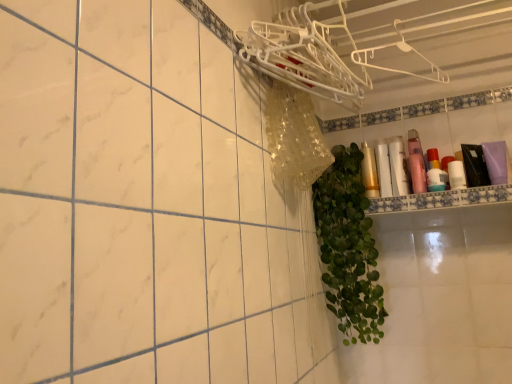
Describe the element at coordinates (383, 169) in the screenshot. I see `matte gold tube at upper right, which is the 2th toiletry in left-to-right order` at that location.

In order to face white glossy bottle at upper right, which ranks as the 3th toiletry in left-to-right order, should I rotate leftwards or rightwards?

Rotate right and turn 18.752 degrees.

This screenshot has width=512, height=384. What do you see at coordinates (442, 199) in the screenshot?
I see `white glossy shelf at upper right` at bounding box center [442, 199].

This screenshot has width=512, height=384. What are the coordinates of `pink matte bottle at upper right, the 4th toiletry viewed from the left` in the screenshot? It's located at (416, 163).

This screenshot has width=512, height=384. What do you see at coordinates (303, 55) in the screenshot? I see `white plastic hanger at upper right, which ranks as the second hanger in right-to-left order` at bounding box center [303, 55].

The image size is (512, 384). Identify the location of gold metallic can at center, which is the first toiletry in left-to-right order. (369, 172).

Is white glossy shelf at upper right wider or thinner than translucent plastic bottles at upper right, the 1th toiletry in the right-to-left sequence?

white glossy shelf at upper right is wider than translucent plastic bottles at upper right, the 1th toiletry in the right-to-left sequence.

From the image's perspective, does white glossy shelf at upper right appear higher than translucent plastic bottles at upper right, positioned as the 5th toiletry in left-to-right order?

Actually, white glossy shelf at upper right appears below translucent plastic bottles at upper right, positioned as the 5th toiletry in left-to-right order, in the image.

Could you tell me if white glossy shelf at upper right is facing translucent plastic bottles at upper right, the 1th toiletry in the right-to-left sequence?

No.

Is white glossy shelf at upper right far away from translucent plastic bottles at upper right, the 1th toiletry in the right-to-left sequence?

No.

Would you consider white glossy bottle at upper right, acting as the 3th toiletry starting from the right, to be distant from matte gold tube at upper right, which is the 2th toiletry in left-to-right order?

No, white glossy bottle at upper right, acting as the 3th toiletry starting from the right, is in close proximity to matte gold tube at upper right, which is the 2th toiletry in left-to-right order.

Visually, is white glossy bottle at upper right, acting as the 3th toiletry starting from the right, positioned to the left or to the right of matte gold tube at upper right, which is the 4th toiletry from right to left?

Clearly, white glossy bottle at upper right, acting as the 3th toiletry starting from the right, is on the right of matte gold tube at upper right, which is the 4th toiletry from right to left, in the image.

Between point (401, 187) and point (382, 164), which one is positioned behind?

The point (382, 164) is more distant.

From a real-world perspective, which object stands above the other?

matte gold tube at upper right, which is the 4th toiletry from right to left, from a real-world perspective.

Are green leafy plant at right and matte gold tube at upper right, which is the 2th toiletry in left-to-right order, making contact?

No, green leafy plant at right is not making contact with matte gold tube at upper right, which is the 2th toiletry in left-to-right order.

Is green leafy plant at right positioned with its back to matte gold tube at upper right, which is the 4th toiletry from right to left?

No, green leafy plant at right's orientation is not away from matte gold tube at upper right, which is the 4th toiletry from right to left.

Is green leafy plant at right at the left side of matte gold tube at upper right, which is the 4th toiletry from right to left?

Yes, green leafy plant at right is to the left of matte gold tube at upper right, which is the 4th toiletry from right to left.

Is gold metallic can at center, which is the first toiletry in left-to-right order, completely or partially inside matte gold tube at upper right, which is the 2th toiletry in left-to-right order?

No, gold metallic can at center, which is the first toiletry in left-to-right order, is located outside of matte gold tube at upper right, which is the 2th toiletry in left-to-right order.

Can you confirm if matte gold tube at upper right, which is the 4th toiletry from right to left, is taller than gold metallic can at center, which is the first toiletry in left-to-right order?

Yes.

From the image's perspective, is matte gold tube at upper right, which is the 4th toiletry from right to left, located beneath gold metallic can at center, which is the first toiletry in left-to-right order?

Actually, matte gold tube at upper right, which is the 4th toiletry from right to left, appears above gold metallic can at center, which is the first toiletry in left-to-right order, in the image.

Does point (321, 241) come closer to viewer compared to point (318, 49)?

That is False.

From the image's perspective, is green leafy plant at right over white plastic hanger at upper right, which ranks as the second hanger in right-to-left order?

Incorrect, from the image's perspective, green leafy plant at right is lower than white plastic hanger at upper right, which ranks as the second hanger in right-to-left order.

Between green leafy plant at right and white plastic hanger at upper right, the first hanger in the left-to-right sequence, which one has less height?

With less height is white plastic hanger at upper right, the first hanger in the left-to-right sequence.

Locate an element on the screen. hanger on the left of green leafy plant at right is located at coordinates (303, 55).

Does white glossy shelf at upper right turn towards white glossy bottle at upper right, which ranks as the 3th toiletry in left-to-right order?

No, white glossy shelf at upper right does not turn towards white glossy bottle at upper right, which ranks as the 3th toiletry in left-to-right order.

Based on their sizes in the image, would you say white glossy shelf at upper right is bigger or smaller than white glossy bottle at upper right, which ranks as the 3th toiletry in left-to-right order?

Clearly, white glossy shelf at upper right is larger in size than white glossy bottle at upper right, which ranks as the 3th toiletry in left-to-right order.

Does white glossy shelf at upper right appear on the left side of white glossy bottle at upper right, acting as the 3th toiletry starting from the right?

No, white glossy shelf at upper right is not to the left of white glossy bottle at upper right, acting as the 3th toiletry starting from the right.

Can you confirm if white glossy shelf at upper right is shorter than white glossy bottle at upper right, acting as the 3th toiletry starting from the right?

Yes.

Is green leafy plant at right positioned far away from white glossy bottle at upper right, acting as the 3th toiletry starting from the right?

No, green leafy plant at right is not far from white glossy bottle at upper right, acting as the 3th toiletry starting from the right.

From a real-world perspective, is green leafy plant at right beneath white glossy bottle at upper right, acting as the 3th toiletry starting from the right?

Yes.

Would you say green leafy plant at right is inside or outside white glossy bottle at upper right, which ranks as the 3th toiletry in left-to-right order?

green leafy plant at right is not inside white glossy bottle at upper right, which ranks as the 3th toiletry in left-to-right order, it's outside.

Can you confirm if green leafy plant at right is bigger than white glossy bottle at upper right, which ranks as the 3th toiletry in left-to-right order?

Correct, green leafy plant at right is larger in size than white glossy bottle at upper right, which ranks as the 3th toiletry in left-to-right order.

Locate an element on the screen. The image size is (512, 384). ledge that appears on the left of translucent plastic bottles at upper right, positioned as the 5th toiletry in left-to-right order is located at coordinates (442, 199).

Identify the location of the 1st toiletry located above the matte gold tube at upper right, which is the 2th toiletry in left-to-right order (from a real-world perspective). This screenshot has height=384, width=512. tap(398, 166).

When comparing their distances from white glossy bottle at upper right, acting as the 3th toiletry starting from the right, does gold metallic can at center, which appears as the fifth toiletry when viewed from the right, or white plastic hanger at upper right, the first hanger in the left-to-right sequence, seem further?

white plastic hanger at upper right, the first hanger in the left-to-right sequence, lies further to white glossy bottle at upper right, acting as the 3th toiletry starting from the right, than the other object.

Consider the image. Looking at the image, which one is located closer to pink matte bottle at upper right, placed as the 2th toiletry when sorted from right to left, green leafy plant at right or white glossy shelf at upper right?

Based on the image, white glossy shelf at upper right appears to be nearer to pink matte bottle at upper right, placed as the 2th toiletry when sorted from right to left.

Estimate the real-world distances between objects in this image. Which object is closer to gold metallic can at center, which is the first toiletry in left-to-right order, white glossy bottle at upper right, which ranks as the 3th toiletry in left-to-right order, or white glossy shelf at upper right?

white glossy bottle at upper right, which ranks as the 3th toiletry in left-to-right order.

From the image, which object appears to be nearer to white glossy bottle at upper right, acting as the 3th toiletry starting from the right, green leafy plant at right or white plastic hanger at upper right, the first hanger viewed from the right?

green leafy plant at right.

Looking at the image, which one is located closer to green leafy plant at right, white glossy shelf at upper right or white plastic hanger at upper right, which appears as the 2th hanger when viewed from the left?

white glossy shelf at upper right is closer to green leafy plant at right.

Estimate the real-world distances between objects in this image. Which object is closer to white plastic hanger at upper right, which ranks as the second hanger in right-to-left order, translucent plastic bottles at upper right, positioned as the 5th toiletry in left-to-right order, or gold metallic can at center, which appears as the fifth toiletry when viewed from the right?

gold metallic can at center, which appears as the fifth toiletry when viewed from the right.

Looking at the image, which one is located further to white plastic hanger at upper right, the first hanger in the left-to-right sequence, gold metallic can at center, which appears as the fifth toiletry when viewed from the right, or white glossy bottle at upper right, acting as the 3th toiletry starting from the right?

Among the two, white glossy bottle at upper right, acting as the 3th toiletry starting from the right, is located further to white plastic hanger at upper right, the first hanger in the left-to-right sequence.

Which object lies further to the anchor point green leafy plant at right, matte gold tube at upper right, which is the 2th toiletry in left-to-right order, or white glossy shelf at upper right?

Based on the image, matte gold tube at upper right, which is the 2th toiletry in left-to-right order, appears to be further to green leafy plant at right.

The height and width of the screenshot is (384, 512). I want to click on hanger located between white plastic hanger at upper right, the first hanger in the left-to-right sequence, and gold metallic can at center, which is the first toiletry in left-to-right order, in the depth direction, so click(x=402, y=51).

In order to click on toiletry located between gold metallic can at center, which appears as the fifth toiletry when viewed from the right, and white glossy bottle at upper right, which ranks as the 3th toiletry in left-to-right order, in the left-right direction in this screenshot , I will do `click(383, 169)`.

In order to click on toiletry located between white plastic hanger at upper right, which ranks as the second hanger in right-to-left order, and white glossy bottle at upper right, acting as the 3th toiletry starting from the right, in the depth direction in this screenshot , I will do `click(416, 163)`.

Identify the location of toiletry between white glossy bottle at upper right, which ranks as the 3th toiletry in left-to-right order, and translucent plastic bottles at upper right, the 1th toiletry in the right-to-left sequence. The image size is (512, 384). (416, 163).